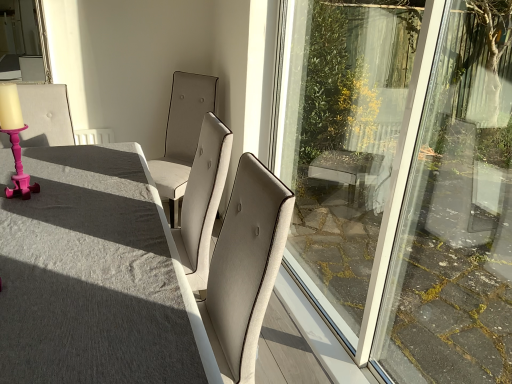
The width and height of the screenshot is (512, 384). What do you see at coordinates (182, 136) in the screenshot?
I see `satin beige chair at center, which is the 1th chair in right-to-left order` at bounding box center [182, 136].

Find the location of a particular element. This screenshot has width=512, height=384. matte gray table at center is located at coordinates (94, 276).

Considering the relative sizes of pink plastic candlestick at left, placed as the first chair when sorted from left to right, and matte gray table at center in the image provided, is pink plastic candlestick at left, placed as the first chair when sorted from left to right, smaller than matte gray table at center?

Correct, pink plastic candlestick at left, placed as the first chair when sorted from left to right, occupies less space than matte gray table at center.

Would you say pink plastic candlestick at left, placed as the first chair when sorted from left to right, is to the left or to the right of matte gray table at center in the picture?

pink plastic candlestick at left, placed as the first chair when sorted from left to right, is to the left of matte gray table at center.

Does satin beige chair at center, which is the 1th chair in right-to-left order, have a lesser height compared to pink wood candle holder at left?

No, satin beige chair at center, which is the 1th chair in right-to-left order, is not shorter than pink wood candle holder at left.

Which is closer, (215, 79) or (0, 94)?

Point (215, 79) is positioned farther from the camera compared to point (0, 94).

Does satin beige chair at center, which is the 2th chair in left-to-right order, appear on the left side of pink wood candle holder at left?

In fact, satin beige chair at center, which is the 2th chair in left-to-right order, is to the right of pink wood candle holder at left.

The image size is (512, 384). In the image, there is a satin beige chair at center, which is the 1th chair in right-to-left order. Find the location of `candle holder below it (from the image's perspective)`. candle holder below it (from the image's perspective) is located at coordinates (15, 139).

Could you tell me if matte gray table at center is facing pink wood candle holder at left?

No, matte gray table at center is not aimed at pink wood candle holder at left.

The width and height of the screenshot is (512, 384). I want to click on table that is below the pink wood candle holder at left (from the image's perspective), so click(94, 276).

Is matte gray table at center closer to the viewer compared to pink wood candle holder at left?

Yes, it is in front of pink wood candle holder at left.

Consider the image. From the image's perspective, who appears lower, matte gray table at center or pink wood candle holder at left?

matte gray table at center, from the image's perspective.

Locate an element on the screen. The height and width of the screenshot is (384, 512). table that is below the satin beige chair at center, which is the 2th chair in left-to-right order (from the image's perspective) is located at coordinates tap(94, 276).

Is point (170, 154) in front of point (144, 356)?

No, it is not.

In the image, is satin beige chair at center, which is the 2th chair in left-to-right order, positioned in front of or behind matte gray table at center?

satin beige chair at center, which is the 2th chair in left-to-right order, is behind matte gray table at center.

Considering the sizes of objects satin beige chair at center, which is the 2th chair in left-to-right order, and matte gray table at center in the image provided, who is thinner, satin beige chair at center, which is the 2th chair in left-to-right order, or matte gray table at center?

With smaller width is satin beige chair at center, which is the 2th chair in left-to-right order.

Can you confirm if pink wood candle holder at left is taller than pink plastic candlestick at left, placed as the first chair when sorted from left to right?

No.

Which is nearer, (13, 148) or (53, 124)?

Positioned in front is point (13, 148).

From the image's perspective, is pink wood candle holder at left under pink plastic candlestick at left, placed as the first chair when sorted from left to right?

Yes.

Is pink wood candle holder at left next to pink plastic candlestick at left, the second chair when ordered from right to left?

No, pink wood candle holder at left is not in contact with pink plastic candlestick at left, the second chair when ordered from right to left.

Is satin beige chair at center, which is the 2th chair in left-to-right order, at the back of pink plastic candlestick at left, placed as the first chair when sorted from left to right?

No.

Relative to satin beige chair at center, which is the 2th chair in left-to-right order, is pink plastic candlestick at left, the second chair when ordered from right to left, in front or behind?

Clearly, pink plastic candlestick at left, the second chair when ordered from right to left, is in front of satin beige chair at center, which is the 2th chair in left-to-right order.

Is pink plastic candlestick at left, placed as the first chair when sorted from left to right, next to satin beige chair at center, which is the 2th chair in left-to-right order?

No, pink plastic candlestick at left, placed as the first chair when sorted from left to right, is not in contact with satin beige chair at center, which is the 2th chair in left-to-right order.

From the image's perspective, which object appears higher, satin beige chair at center, which is the 2th chair in left-to-right order, or pink plastic candlestick at left, the second chair when ordered from right to left?

From the image's view, satin beige chair at center, which is the 2th chair in left-to-right order, is above.

You are a GUI agent. You are given a task and a screenshot of the screen. Output one action in this format:
    pyautogui.click(x=<x>, y=<y>)
    Task: Click on the chair that appears in front of the satin beige chair at center, which is the 2th chair in left-to-right order
    This screenshot has height=384, width=512.
    Given the screenshot: What is the action you would take?
    pyautogui.click(x=45, y=115)

Can you confirm if satin beige chair at center, which is the 2th chair in left-to-right order, is wider than pink plastic candlestick at left, placed as the first chair when sorted from left to right?

Indeed, satin beige chair at center, which is the 2th chair in left-to-right order, has a greater width compared to pink plastic candlestick at left, placed as the first chair when sorted from left to right.

Locate an element on the screen. This screenshot has height=384, width=512. the 1st chair behind the matte gray table at center, starting your count from the anchor is located at coordinates (45, 115).

At what (x,y) coordinates should I click in order to perform the action: click on the 2nd chair above the pink wood candle holder at left (from the image's perspective). Please return your answer as a coordinate pair (x, y). Looking at the image, I should click on (182, 136).

Considering their positions, is matte gray table at center positioned closer to satin beige chair at center, which is the 2th chair in left-to-right order, than pink wood candle holder at left?

pink wood candle holder at left lies closer to satin beige chair at center, which is the 2th chair in left-to-right order, than the other object.

Looking at the image, which one is located further to pink plastic candlestick at left, the second chair when ordered from right to left, pink wood candle holder at left or matte gray table at center?

Based on the image, matte gray table at center appears to be further to pink plastic candlestick at left, the second chair when ordered from right to left.

Looking at the image, which one is located further to satin beige chair at center, which is the 1th chair in right-to-left order, matte gray table at center or pink plastic candlestick at left, the second chair when ordered from right to left?

matte gray table at center.

Considering their positions, is satin beige chair at center, which is the 1th chair in right-to-left order, positioned further to matte gray table at center than pink wood candle holder at left?

The object further to matte gray table at center is satin beige chair at center, which is the 1th chair in right-to-left order.

Which object lies nearer to the anchor point satin beige chair at center, which is the 2th chair in left-to-right order, pink wood candle holder at left or matte gray table at center?

pink wood candle holder at left is closer to satin beige chair at center, which is the 2th chair in left-to-right order.

Which object lies nearer to the anchor point pink plastic candlestick at left, the second chair when ordered from right to left, pink wood candle holder at left or satin beige chair at center, which is the 2th chair in left-to-right order?

pink wood candle holder at left lies closer to pink plastic candlestick at left, the second chair when ordered from right to left, than the other object.

When comparing their distances from pink wood candle holder at left, does pink plastic candlestick at left, placed as the first chair when sorted from left to right, or matte gray table at center seem further?

matte gray table at center lies further to pink wood candle holder at left than the other object.

When comparing their distances from matte gray table at center, does pink plastic candlestick at left, placed as the first chair when sorted from left to right, or pink wood candle holder at left seem further?

Among the two, pink plastic candlestick at left, placed as the first chair when sorted from left to right, is located further to matte gray table at center.

What are the coordinates of `chair between pink wood candle holder at left and satin beige chair at center, which is the 2th chair in left-to-right order, from front to back` in the screenshot? It's located at (45, 115).

Where is `candle holder located between matte gray table at center and pink plastic candlestick at left, placed as the first chair when sorted from left to right, in the depth direction`? candle holder located between matte gray table at center and pink plastic candlestick at left, placed as the first chair when sorted from left to right, in the depth direction is located at coordinates (15, 139).

Where is `candle holder between matte gray table at center and satin beige chair at center, which is the 2th chair in left-to-right order, from front to back`? This screenshot has width=512, height=384. candle holder between matte gray table at center and satin beige chair at center, which is the 2th chair in left-to-right order, from front to back is located at coordinates (15, 139).

The height and width of the screenshot is (384, 512). I want to click on chair between matte gray table at center and satin beige chair at center, which is the 2th chair in left-to-right order, along the z-axis, so click(45, 115).